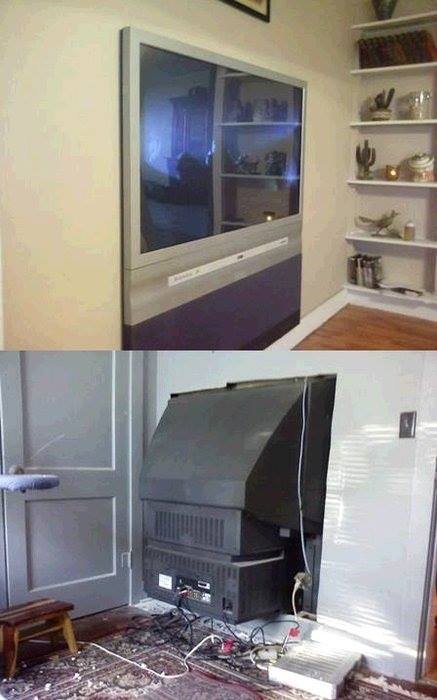
Find the location of `rug`. rug is located at coordinates (138, 682).